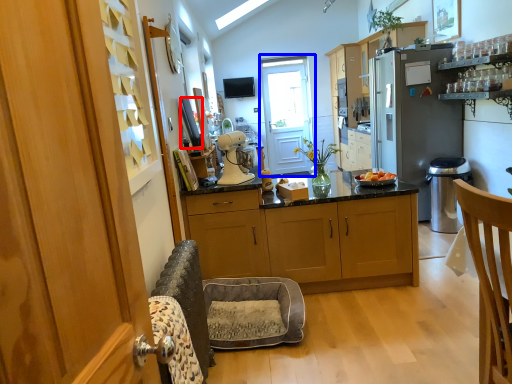
Question: Which object appears farthest to the camera in this image, oven (highlighted by a red box) or screen door (highlighted by a blue box)?

Choices:
 (A) oven
 (B) screen door

Answer: (B)